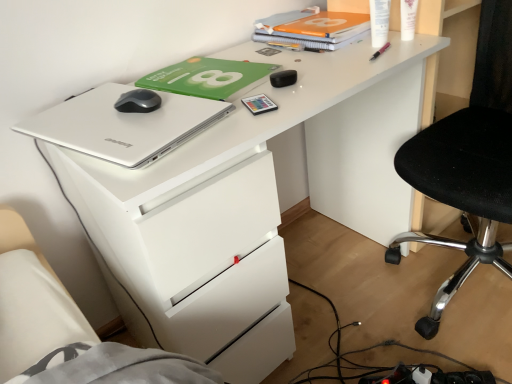
The image size is (512, 384). Identify the location of vacant area located to the right-hand side of pink plastic pen at upper right, which is the 3th stationery from bottom to top. (411, 43).